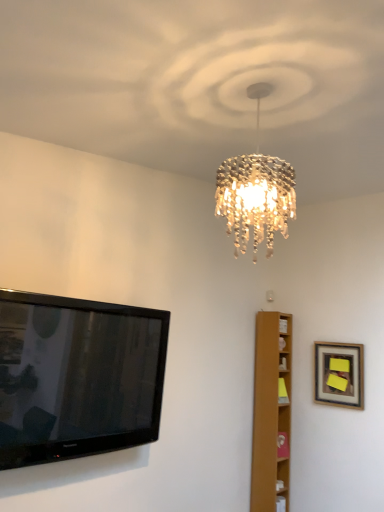
Identify the location of light brown wooden bookshelf at right. (271, 412).

Identify the location of light brown wooden bookshelf at right. (271, 412).

From the image's perspective, is black glossy flat-screen tv at left above or below light brown wooden bookshelf at right?

black glossy flat-screen tv at left is above light brown wooden bookshelf at right.

Is black glossy flat-screen tv at left not near light brown wooden bookshelf at right?

Yes.

Between black glossy flat-screen tv at left and light brown wooden bookshelf at right, which one has more height?

light brown wooden bookshelf at right.

Which object is closer to the camera taking this photo, black glossy flat-screen tv at left or light brown wooden bookshelf at right?

black glossy flat-screen tv at left is closer to the camera.

Is wooden framed picture at upper right placed right next to black glossy flat-screen tv at left?

No.

Is wooden framed picture at upper right to the left of black glossy flat-screen tv at left from the viewer's perspective?

In fact, wooden framed picture at upper right is to the right of black glossy flat-screen tv at left.

How many degrees apart are the facing directions of wooden framed picture at upper right and black glossy flat-screen tv at left?

They differ by 87.8 degrees in their facing directions.

Can you confirm if wooden framed picture at upper right is wider than black glossy flat-screen tv at left?

In fact, wooden framed picture at upper right might be narrower than black glossy flat-screen tv at left.

From the image's perspective, which object appears higher, black glossy flat-screen tv at left or wooden framed picture at upper right?

black glossy flat-screen tv at left.

Is wooden framed picture at upper right at the back of black glossy flat-screen tv at left?

black glossy flat-screen tv at left is not turned away from wooden framed picture at upper right.

How many degrees apart are the facing directions of black glossy flat-screen tv at left and wooden framed picture at upper right?

The facing directions of black glossy flat-screen tv at left and wooden framed picture at upper right are 87.8 degrees apart.

How many degrees apart are the facing directions of wooden framed picture at upper right and light brown wooden bookshelf at right?

wooden framed picture at upper right and light brown wooden bookshelf at right are facing 89.8 degrees away from each other.

Would you say light brown wooden bookshelf at right is part of wooden framed picture at upper right's contents?

No, light brown wooden bookshelf at right is not surrounded by wooden framed picture at upper right.

From the image's perspective, is wooden framed picture at upper right on top of light brown wooden bookshelf at right?

Yes, from the image's perspective, wooden framed picture at upper right is above light brown wooden bookshelf at right.

Looking at this image, can you confirm if wooden framed picture at upper right is taller than light brown wooden bookshelf at right?

No, wooden framed picture at upper right is not taller than light brown wooden bookshelf at right.

Does light brown wooden bookshelf at right have a lesser width compared to black glossy flat-screen tv at left?

In fact, light brown wooden bookshelf at right might be wider than black glossy flat-screen tv at left.

Can you confirm if light brown wooden bookshelf at right is positioned to the right of black glossy flat-screen tv at left?

Correct, you'll find light brown wooden bookshelf at right to the right of black glossy flat-screen tv at left.

Is light brown wooden bookshelf at right completely or partially outside of black glossy flat-screen tv at left?

Yes, light brown wooden bookshelf at right is not within black glossy flat-screen tv at left.

Would you consider light brown wooden bookshelf at right to be distant from wooden framed picture at upper right?

No, light brown wooden bookshelf at right is not far from wooden framed picture at upper right.

Can you confirm if light brown wooden bookshelf at right is bigger than wooden framed picture at upper right?

Yes, light brown wooden bookshelf at right is bigger than wooden framed picture at upper right.

From a real-world perspective, is light brown wooden bookshelf at right under wooden framed picture at upper right?

Yes.

How far apart are light brown wooden bookshelf at right and wooden framed picture at upper right?

light brown wooden bookshelf at right is 15.08 inches from wooden framed picture at upper right.

This screenshot has height=512, width=384. Identify the location of television located on the left of light brown wooden bookshelf at right. (77, 377).

The width and height of the screenshot is (384, 512). I want to click on television in front of the wooden framed picture at upper right, so click(77, 377).

Considering their positions, is black glossy flat-screen tv at left positioned closer to light brown wooden bookshelf at right than wooden framed picture at upper right?

wooden framed picture at upper right is positioned closer to the anchor light brown wooden bookshelf at right.

Looking at the image, which one is located closer to light brown wooden bookshelf at right, wooden framed picture at upper right or black glossy flat-screen tv at left?

wooden framed picture at upper right lies closer to light brown wooden bookshelf at right than the other object.

Considering their positions, is black glossy flat-screen tv at left positioned further to wooden framed picture at upper right than light brown wooden bookshelf at right?

The object further to wooden framed picture at upper right is black glossy flat-screen tv at left.

Looking at the image, which one is located closer to black glossy flat-screen tv at left, wooden framed picture at upper right or light brown wooden bookshelf at right?

Based on the image, light brown wooden bookshelf at right appears to be nearer to black glossy flat-screen tv at left.

From the picture: Which object lies further to the anchor point wooden framed picture at upper right, light brown wooden bookshelf at right or black glossy flat-screen tv at left?

The object further to wooden framed picture at upper right is black glossy flat-screen tv at left.

Which object lies further to the anchor point black glossy flat-screen tv at left, light brown wooden bookshelf at right or wooden framed picture at upper right?

wooden framed picture at upper right lies further to black glossy flat-screen tv at left than the other object.

The image size is (384, 512). I want to click on furniture between black glossy flat-screen tv at left and wooden framed picture at upper right in the horizontal direction, so click(x=271, y=412).